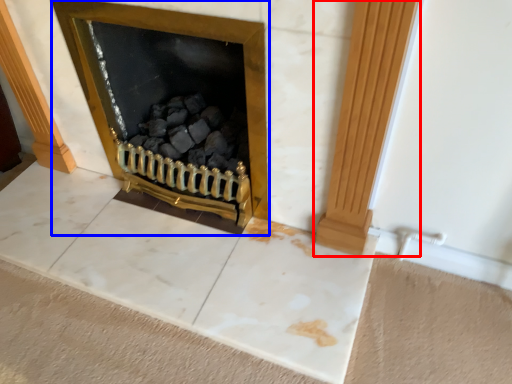
Question: Which of the following is the farthest to the observer, pillar (highlighted by a red box) or fireplace (highlighted by a blue box)?

Choices:
 (A) pillar
 (B) fireplace

Answer: (B)